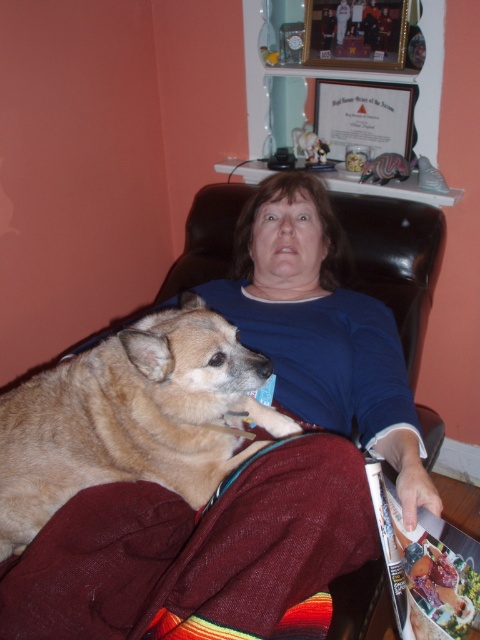
Can you confirm if blue cotton shirt at upper center is wider than matte plastic magazine at lower right?

Correct, the width of blue cotton shirt at upper center exceeds that of matte plastic magazine at lower right.

Measure the distance between blue cotton shirt at upper center and camera.

30.73 inches

This screenshot has width=480, height=640. What are the coordinates of `blue cotton shirt at upper center` in the screenshot? It's located at (322, 330).

Does burgundy fleece blanket at lower left have a larger size compared to light brown fur at center?

No, burgundy fleece blanket at lower left is not bigger than light brown fur at center.

Can you confirm if burgundy fleece blanket at lower left is smaller than light brown fur at center?

Yes.

What do you see at coordinates (195, 552) in the screenshot? I see `burgundy fleece blanket at lower left` at bounding box center [195, 552].

You are a GUI agent. You are given a task and a screenshot of the screen. Output one action in this format:
    pyautogui.click(x=<x>, y=<y>)
    Task: Click on the burgundy fleece blanket at lower left
    The image size is (480, 640).
    Given the screenshot: What is the action you would take?
    pyautogui.click(x=195, y=552)

Can you confirm if light brown fur at center is positioned to the right of matte plastic magazine at lower right?

Incorrect, light brown fur at center is not on the right side of matte plastic magazine at lower right.

Can you confirm if light brown fur at center is wider than matte plastic magazine at lower right?

Correct, the width of light brown fur at center exceeds that of matte plastic magazine at lower right.

Where is `light brown fur at center`? The image size is (480, 640). light brown fur at center is located at coordinates (132, 417).